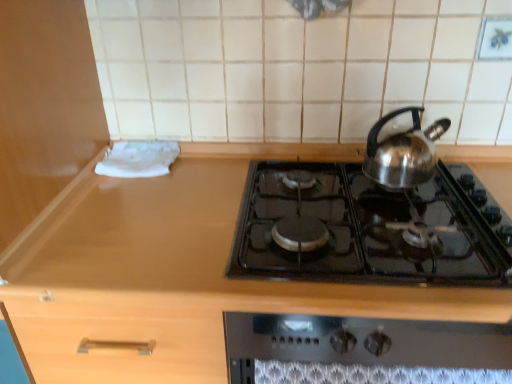
Question: Can we say wooden counter at center lies outside shiny metallic kettle at upper right?

Choices:
 (A) no
 (B) yes

Answer: (B)

Question: From a real-world perspective, is wooden counter at center under shiny metallic kettle at upper right?

Choices:
 (A) yes
 (B) no

Answer: (A)

Question: Does wooden counter at center touch shiny metallic kettle at upper right?

Choices:
 (A) no
 (B) yes

Answer: (A)

Question: Is wooden counter at center oriented away from shiny metallic kettle at upper right?

Choices:
 (A) yes
 (B) no

Answer: (B)

Question: From a real-world perspective, is wooden counter at center positioned over shiny metallic kettle at upper right based on gravity?

Choices:
 (A) no
 (B) yes

Answer: (A)

Question: Is wooden counter at center in front of shiny metallic kettle at upper right?

Choices:
 (A) yes
 (B) no

Answer: (A)

Question: Does black glass gas stove at center have a greater height compared to shiny metallic kettle at upper right?

Choices:
 (A) yes
 (B) no

Answer: (B)

Question: Could you tell me if black glass gas stove at center is facing shiny metallic kettle at upper right?

Choices:
 (A) yes
 (B) no

Answer: (B)

Question: Are black glass gas stove at center and shiny metallic kettle at upper right beside each other?

Choices:
 (A) no
 (B) yes

Answer: (A)

Question: Can you confirm if black glass gas stove at center is thinner than shiny metallic kettle at upper right?

Choices:
 (A) yes
 (B) no

Answer: (B)

Question: Is black glass gas stove at center to the right of shiny metallic kettle at upper right from the viewer's perspective?

Choices:
 (A) no
 (B) yes

Answer: (A)

Question: From the image's perspective, would you say black glass gas stove at center is shown under shiny metallic kettle at upper right?

Choices:
 (A) yes
 (B) no

Answer: (A)

Question: Is shiny metallic kettle at upper right thinner than black glass gas stove at center?

Choices:
 (A) yes
 (B) no

Answer: (A)